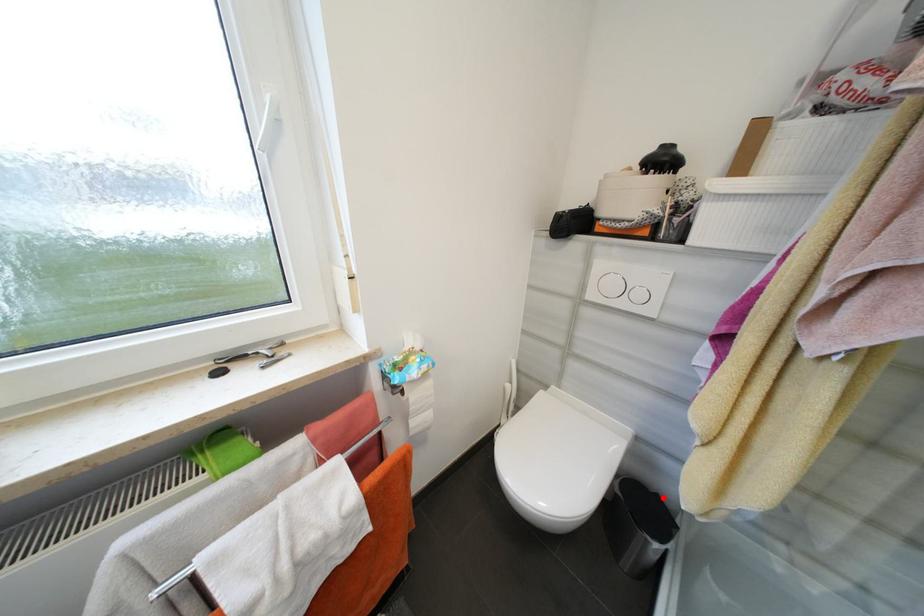
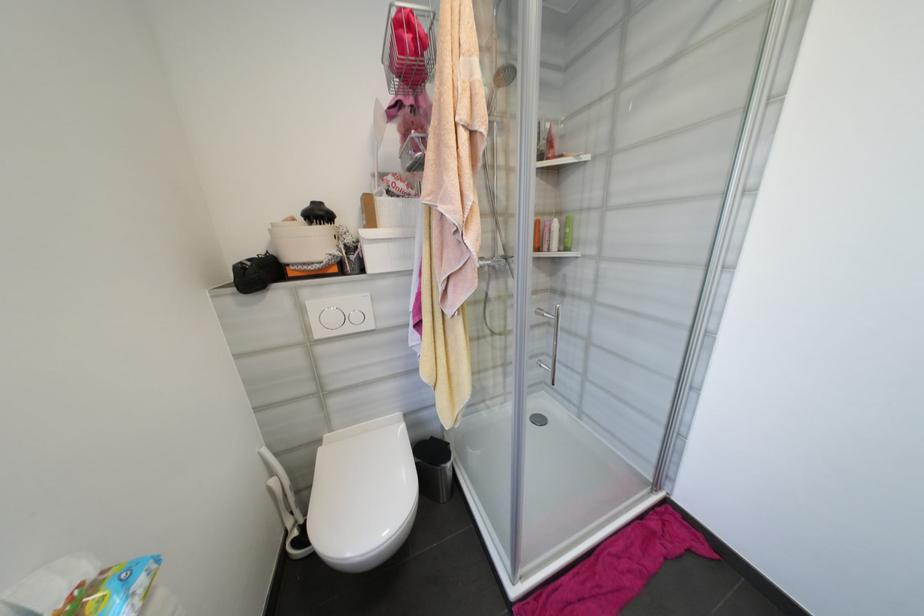
Question: I am providing you with two images of the same scene from different viewpoints. Given a red point in image1, look at the same physical point in image2. Is it:

Choices:
 (A) Closer to the viewpoint
 (B) Farther from the viewpoint

Answer: (B)